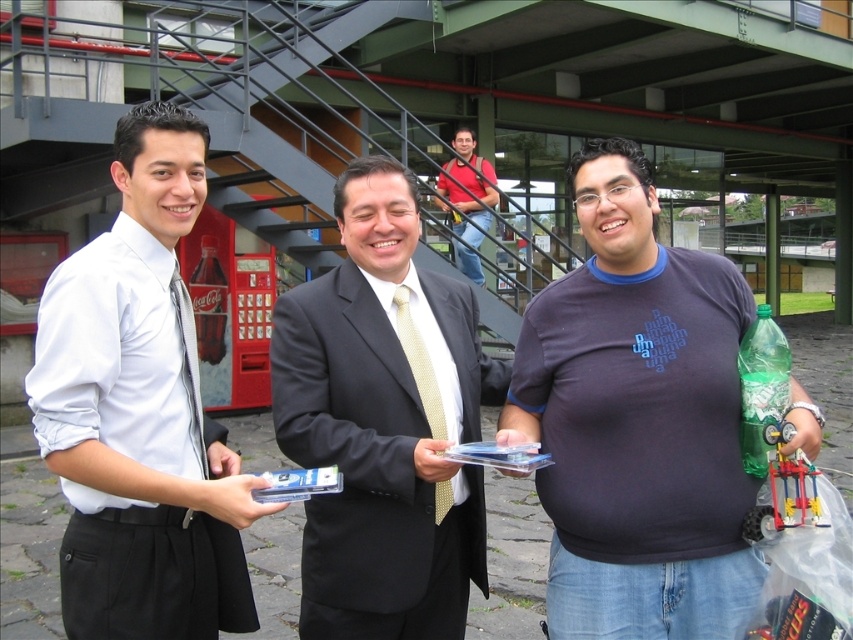
Question: Which point appears closest to the camera in this image?

Choices:
 (A) (492, 403)
 (B) (607, 220)

Answer: (B)

Question: Does matte black suit at center have a larger size compared to gold dotted tie at center?

Choices:
 (A) yes
 (B) no

Answer: (A)

Question: From the image, what is the correct spatial relationship of white satin shirt at left in relation to matte black suit at center?

Choices:
 (A) below
 (B) above

Answer: (B)

Question: Is white satin shirt at left further to camera compared to matte black suit at center?

Choices:
 (A) yes
 (B) no

Answer: (B)

Question: Which object appears closest to the camera in this image?

Choices:
 (A) matte black suit at center
 (B) white satin shirt at left
 (C) red cotton shirt at center

Answer: (B)

Question: Which object appears closest to the camera in this image?

Choices:
 (A) matte black suit at center
 (B) red cotton shirt at center

Answer: (A)